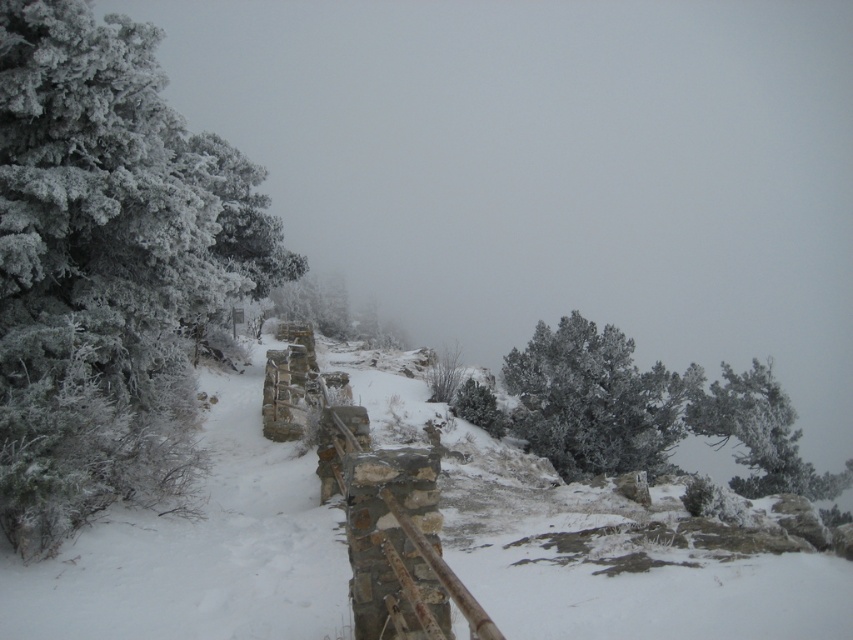
Question: Which of the following is the closest to the observer?

Choices:
 (A) white frosty tree at upper right
 (B) frosted evergreen at left
 (C) frosted pine tree at upper center

Answer: (B)

Question: Is white frosty snow at center below white frosty tree at upper right?

Choices:
 (A) no
 (B) yes

Answer: (A)

Question: Where is white frosty snow at center located in relation to frosted pine tree at upper center in the image?

Choices:
 (A) right
 (B) left

Answer: (B)

Question: Which point is farther to the camera?

Choices:
 (A) frosted pine tree at upper center
 (B) white frosty snow at center
 (C) white frosty tree at upper right

Answer: (C)

Question: Is white frosty snow at center to the left of frosted pine tree at upper center from the viewer's perspective?

Choices:
 (A) yes
 (B) no

Answer: (A)

Question: Which of the following is the closest to the observer?

Choices:
 (A) frosted evergreen at left
 (B) white frosty snow at center

Answer: (B)